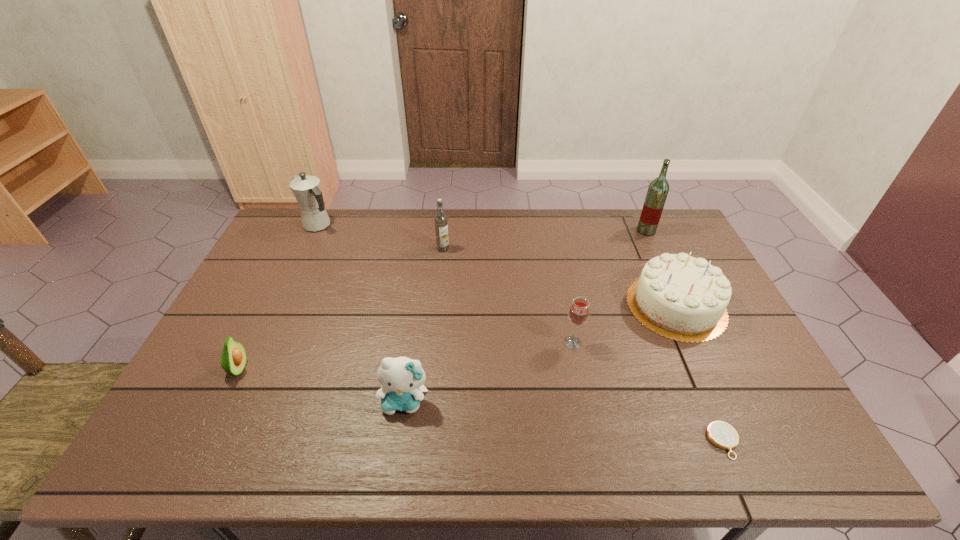
What are the coordinates of `vodka that is at the far edge` in the screenshot? It's located at click(441, 225).

The image size is (960, 540). What are the coordinates of `object at the near edge` in the screenshot? It's located at (721, 434).

Find the location of a particular element. Image resolution: width=960 pixels, height=540 pixels. coffeepot that is at the left edge is located at coordinates (306, 189).

Locate an element on the screen. The height and width of the screenshot is (540, 960). avocado at the left edge is located at coordinates (233, 359).

Locate an element on the screen. liquor that is positioned at the right edge is located at coordinates (658, 189).

I want to click on birthday cake that is positioned at the right edge, so click(683, 298).

Where is `compass present at the right edge`? compass present at the right edge is located at coordinates (721, 434).

Locate an element on the screen. This screenshot has height=540, width=960. object present at the far left corner is located at coordinates (306, 189).

This screenshot has height=540, width=960. I want to click on object that is at the far right corner, so click(658, 189).

At what (x,y) coordinates should I click in order to perform the action: click on object present at the near right corner. Please return your answer as a coordinate pair (x, y). Looking at the image, I should click on (721, 434).